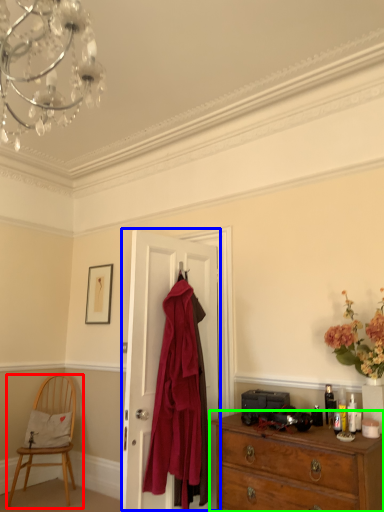
Question: Which object is positioned farthest from chair (highlighted by a red box)? Select from door (highlighted by a blue box) and chest of drawers (highlighted by a green box).

Choices:
 (A) door
 (B) chest of drawers

Answer: (B)